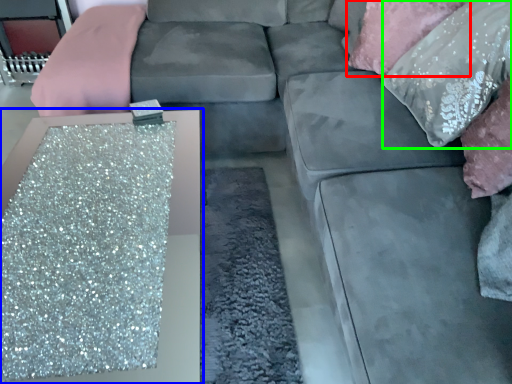
Question: Estimate the real-world distances between objects in this image. Which object is farther from pillow (highlighted by a red box), table (highlighted by a blue box) or pillow (highlighted by a green box)?

Choices:
 (A) table
 (B) pillow

Answer: (A)